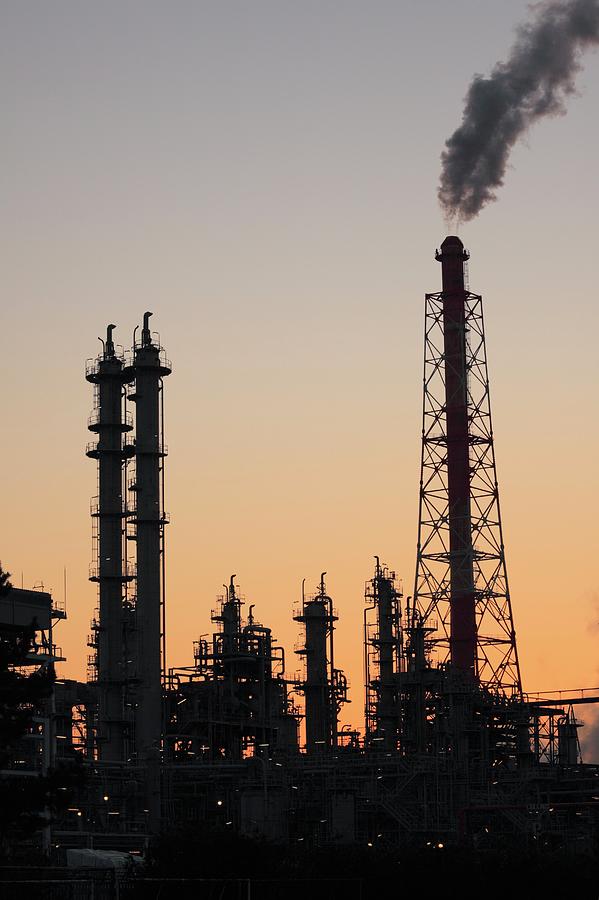
What are the coordinates of `lights` in the screenshot? It's located at (440, 850), (371, 843), (323, 819), (296, 843), (298, 794), (223, 803), (232, 833), (107, 796), (75, 806), (56, 850).